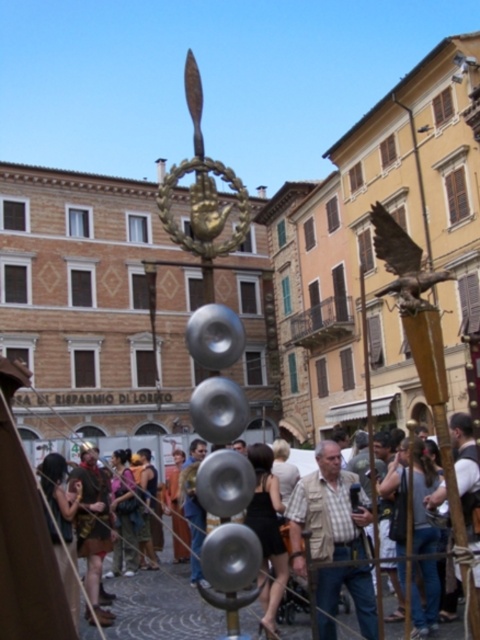
Question: Considering the real-world distances, which object is closest to the bronze eagle at upper right?

Choices:
 (A) light brown leather jacket at center
 (B) matte silver bell at center

Answer: (A)

Question: From the image, what is the correct spatial relationship of gold metallic hand at center in relation to denim shorts at lower left?

Choices:
 (A) left
 (B) right

Answer: (A)

Question: Observing the image, what is the correct spatial positioning of matte silver bell at center in reference to bronze eagle at upper right?

Choices:
 (A) above
 (B) below

Answer: (B)

Question: Can you confirm if gold metallic hand at center is positioned to the left of denim shorts at lower left?

Choices:
 (A) no
 (B) yes

Answer: (B)

Question: Among these points, which one is farthest from the camera?

Choices:
 (A) (94, 506)
 (B) (302, 496)
 (C) (193, 77)
 (D) (177, 636)

Answer: (A)

Question: Which object appears closest to the camera in this image?

Choices:
 (A) gold metallic hand at center
 (B) matte silver bell at center
 (C) light brown leather jacket at center

Answer: (A)